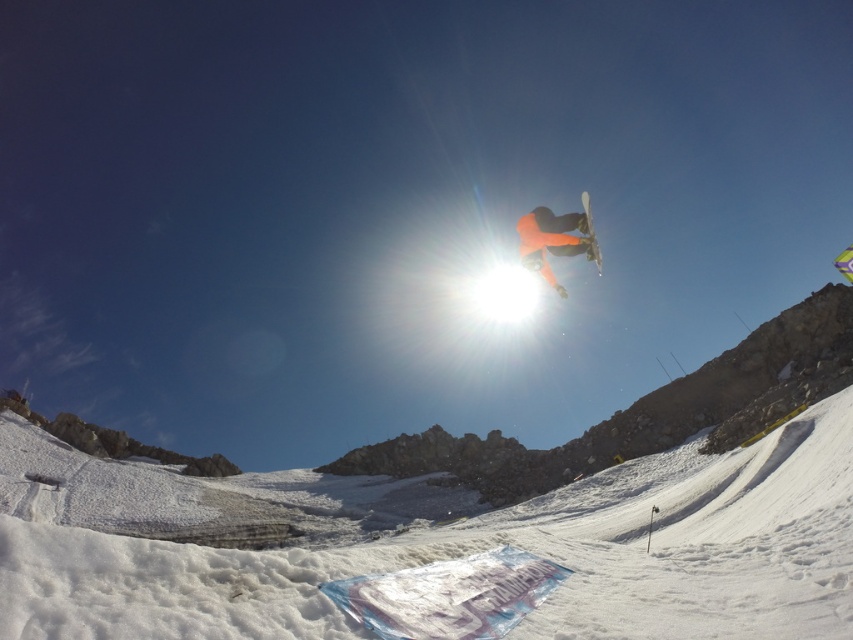
You are a photographer trying to capture the orange matte snowboarder at center in a photo. The camera is set to focus on the point at coordinates point (556,237). Will the orange matte snowboarder at center be in focus?

The point (556,237) marks the orange matte snowboarder at center, so yes, the orange matte snowboarder at center will be in focus as the camera is focused on that point.